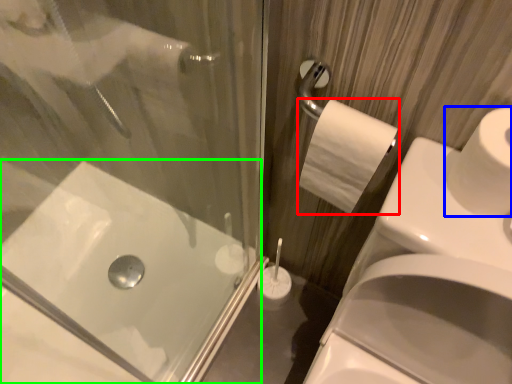
Question: Considering the real-world distances, which object is closest to toilet paper (highlighted by a red box)? toilet paper (highlighted by a blue box) or bath (highlighted by a green box).

Choices:
 (A) toilet paper
 (B) bath

Answer: (A)